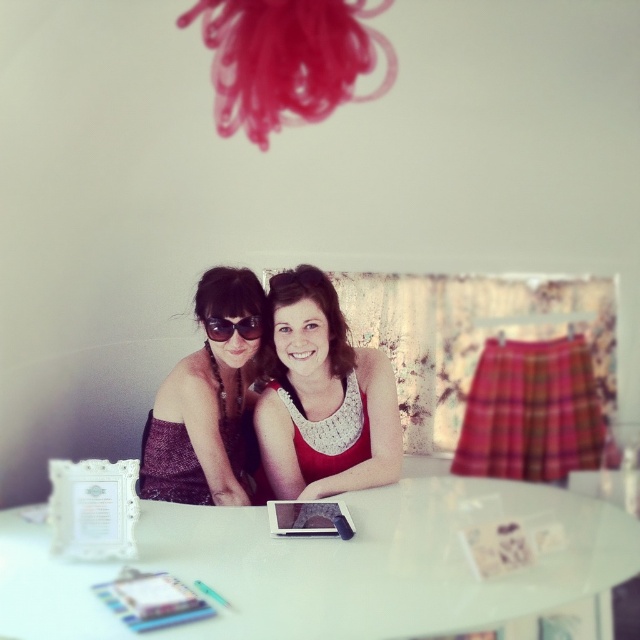
You are a photographer trying to capture a candid shot of the two people at the table. Since the white glossy round table at center and the matte black sunglasses at center are both in the frame, which object should you focus on first to ensure the reflection on the table doesn t interfere with the sunglasses?

The white glossy round table at center is in front of the matte black sunglasses at center, so focusing on the table first will help avoid reflections interfering with the sunglasses.

You are trying to decide which outfit to wear for a casual day out. You see a white lace tank top at center and a matte black dress at center in your closet. Which one is positioned to the right when viewed from the front?

The white lace tank top at center is positioned to the right of the matte black dress at center when viewed from the front.

You are standing in front of the table and want to place a small object on the table. There are two points marked on the table surface. Which point is closer to you, point (360, 348) or point (227, 406)?

Point (227, 406) is closer to you because it is less further to the viewer than point (360, 348).